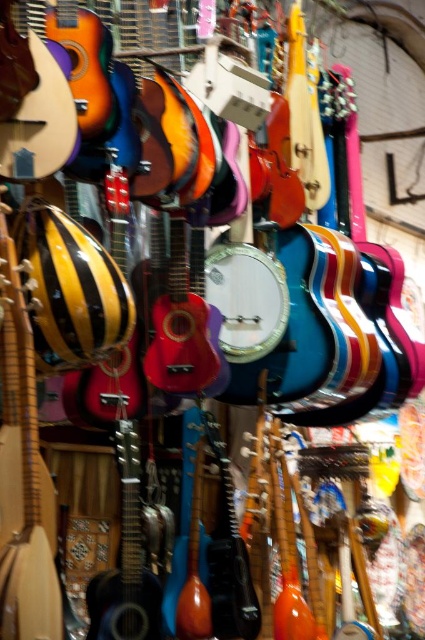
Which is above, matte yellow wood guitar at left or matte black guitar at center?

Positioned higher is matte yellow wood guitar at left.

Who is positioned more to the right, matte yellow wood guitar at left or matte black guitar at center?

From the viewer's perspective, matte black guitar at center appears more on the right side.

Between point (8, 339) and point (116, 422), which one is positioned in front?

Point (8, 339)

Locate an element on the screen. The height and width of the screenshot is (640, 425). matte yellow wood guitar at left is located at coordinates (23, 474).